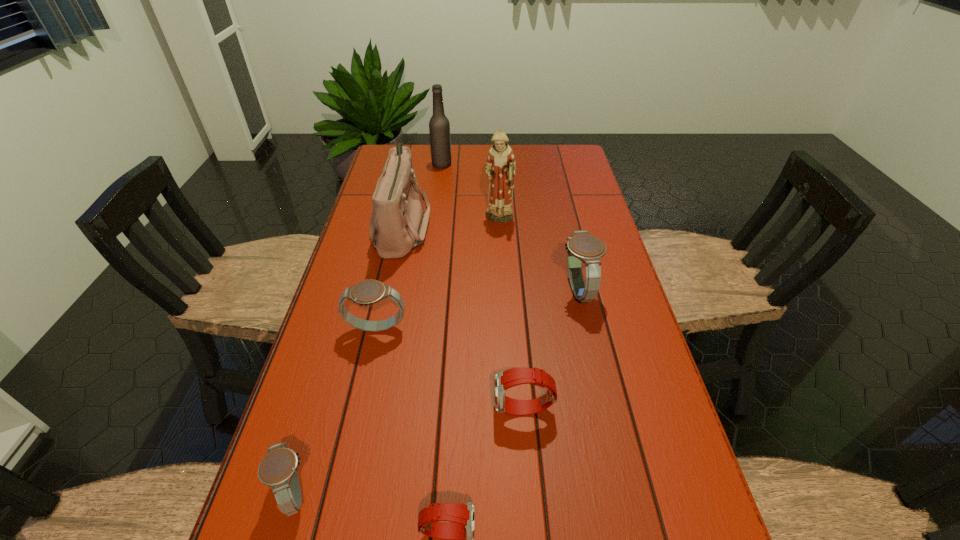
Identify the location of beer bottle. (439, 127).

Find the location of a particular element. The image size is (960, 540). figurine is located at coordinates (500, 169).

The height and width of the screenshot is (540, 960). In order to click on the third tallest object in this screenshot , I will do `click(398, 223)`.

Where is `the rightmost gray watch`? This screenshot has height=540, width=960. the rightmost gray watch is located at coordinates (582, 246).

At what (x,y) coordinates should I click in order to perform the action: click on the biggest gray watch. Please return your answer as a coordinate pair (x, y). Looking at the image, I should click on (582, 246).

Locate an element on the screen. The width and height of the screenshot is (960, 540). the second biggest gray watch is located at coordinates (367, 292).

The height and width of the screenshot is (540, 960). I want to click on the sixth farthest object, so click(x=504, y=380).

You are a GUI agent. You are given a task and a screenshot of the screen. Output one action in this format:
    pyautogui.click(x=<x>, y=<y>)
    Task: Click on the bigger red watch
    The width and height of the screenshot is (960, 540).
    Given the screenshot: What is the action you would take?
    pyautogui.click(x=504, y=380)

I want to click on the nearest gray watch, so click(278, 469).

Locate an element on the screen. This screenshot has width=960, height=540. blank area located 0.140m on the label of the beer bottle is located at coordinates pyautogui.click(x=490, y=164).